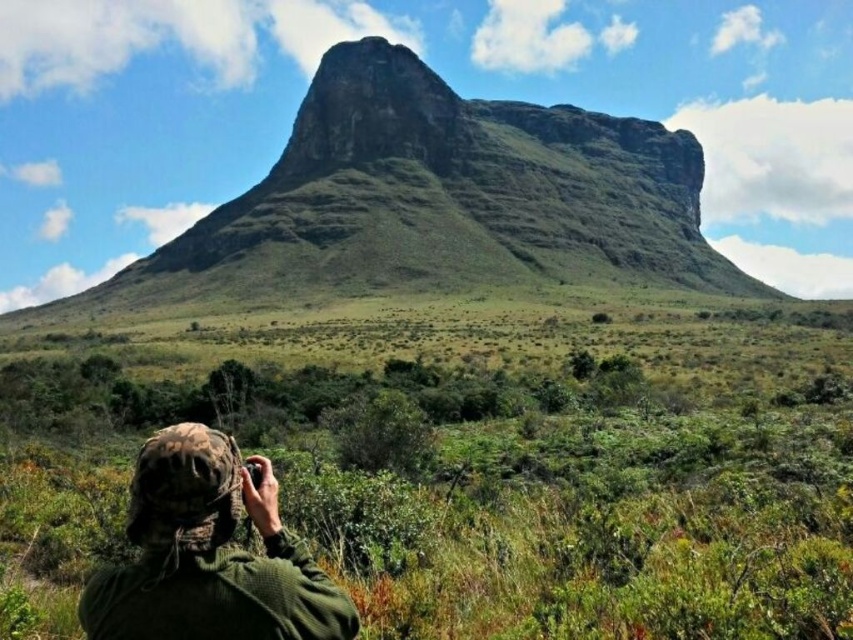
Can you confirm if green grass at center is taller than green grassy mountain at center?

No.

Is green grass at center smaller than green grassy mountain at center?

Indeed, green grass at center has a smaller size compared to green grassy mountain at center.

The width and height of the screenshot is (853, 640). In order to click on green grass at center in this screenshot , I will do `click(483, 460)`.

Image resolution: width=853 pixels, height=640 pixels. What are the coordinates of `green grass at center` in the screenshot? It's located at (x=483, y=460).

Is point (561, 205) positioned after point (160, 531)?

Yes, it is.

Can you confirm if green grassy mountain at center is taller than camo fabric hat at lower left?

Yes, green grassy mountain at center is taller than camo fabric hat at lower left.

Describe the element at coordinates (438, 198) in the screenshot. This screenshot has height=640, width=853. I see `green grassy mountain at center` at that location.

Where is `green grassy mountain at center`? The width and height of the screenshot is (853, 640). green grassy mountain at center is located at coordinates (438, 198).

Is green grass at center taller than camo fabric hat at lower left?

Yes.

Does green grass at center have a greater width compared to camo fabric hat at lower left?

Indeed, green grass at center has a greater width compared to camo fabric hat at lower left.

In order to click on green grass at center in this screenshot , I will do `click(483, 460)`.